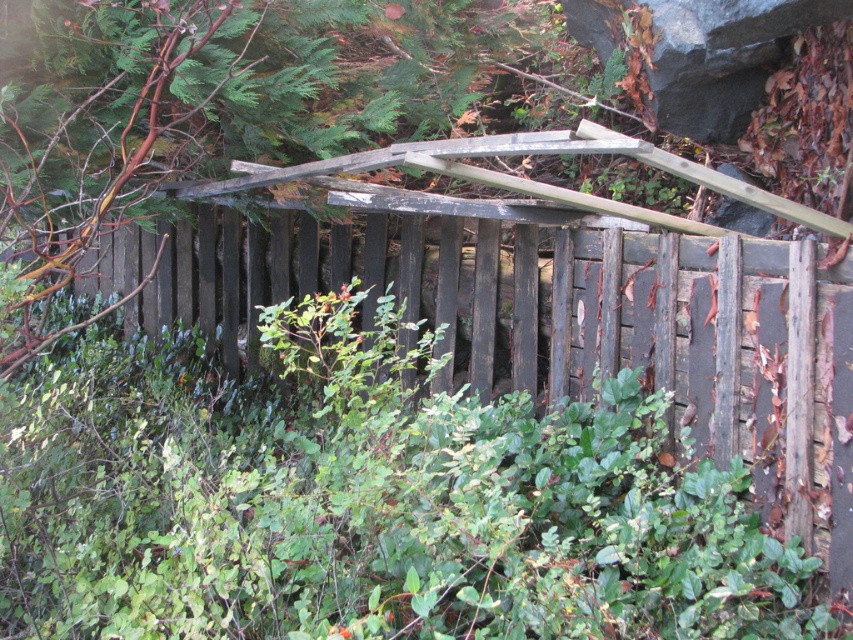
Can you confirm if weathered wood fence at center is thinner than gray rock at upper right?

No.

You are a GUI agent. You are given a task and a screenshot of the screen. Output one action in this format:
    pyautogui.click(x=<x>, y=<y>)
    Task: Click on the weathered wood fence at center
    
    Given the screenshot: What is the action you would take?
    pyautogui.click(x=560, y=323)